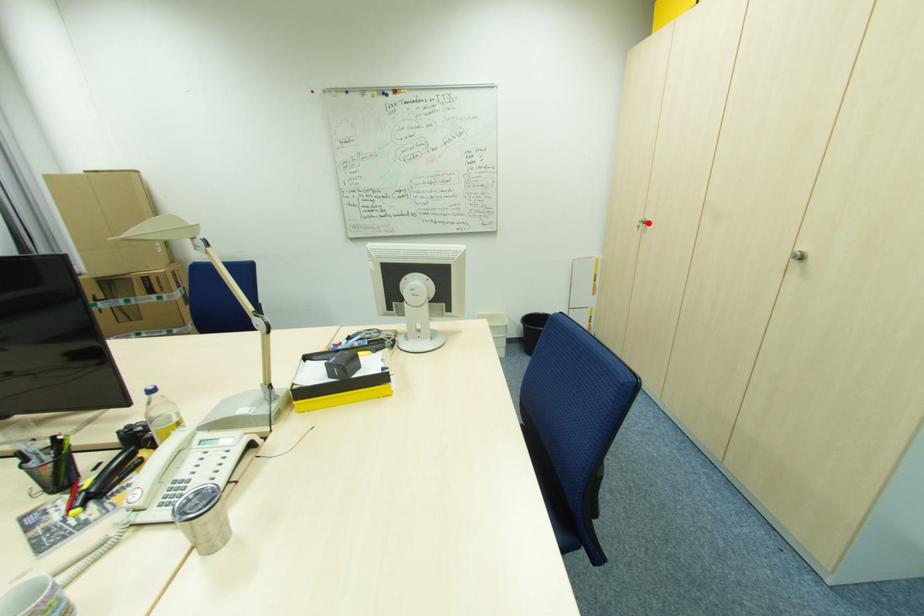
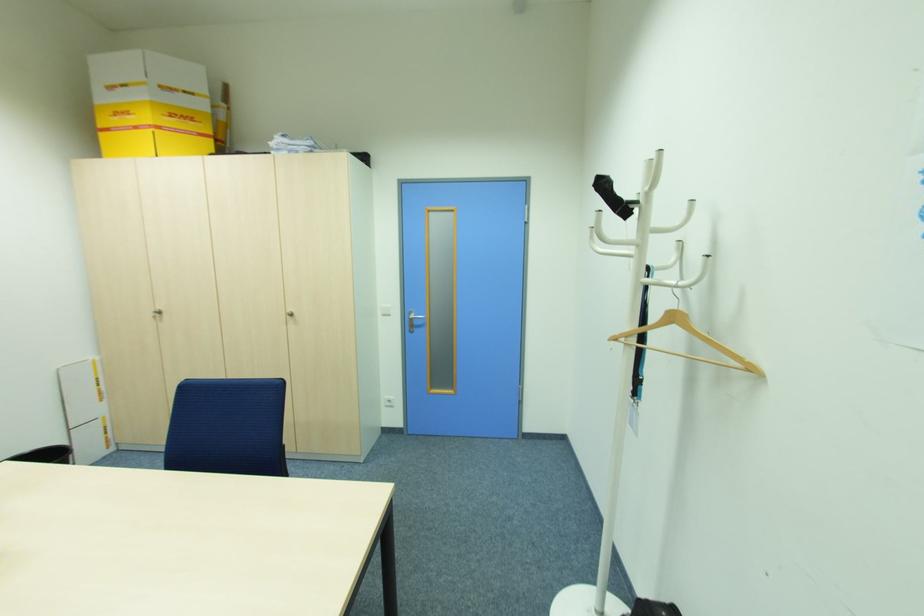
Find the pixel in the second image that matches the highlighted location in the first image.

(162, 312)